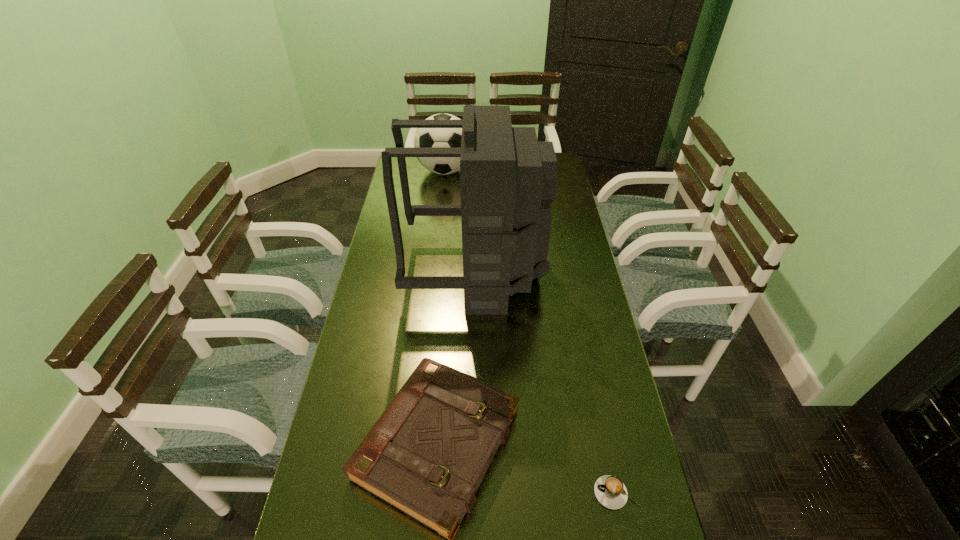
The image size is (960, 540). I want to click on backpack, so click(x=508, y=179).

Locate an element on the screen. The height and width of the screenshot is (540, 960). the tallest object is located at coordinates (508, 179).

Locate an element on the screen. The image size is (960, 540). the farthest object is located at coordinates (424, 137).

Where is `soccer ball`? This screenshot has width=960, height=540. soccer ball is located at coordinates (424, 137).

Locate an element on the screen. The height and width of the screenshot is (540, 960). cappuccino is located at coordinates (610, 491).

This screenshot has width=960, height=540. Find the location of `the rightmost object`. the rightmost object is located at coordinates (610, 491).

Where is `free space located on the front compartment of the backpack`? The width and height of the screenshot is (960, 540). free space located on the front compartment of the backpack is located at coordinates (564, 272).

The image size is (960, 540). Identify the location of free space located on the right of the soccer ball. (491, 171).

Find the location of `vacant region located with the handle on the side of the rightmost object`. vacant region located with the handle on the side of the rightmost object is located at coordinates click(430, 492).

Where is `vacant space located with the handle on the side of the rightmost object`? This screenshot has height=540, width=960. vacant space located with the handle on the side of the rightmost object is located at coordinates (538, 492).